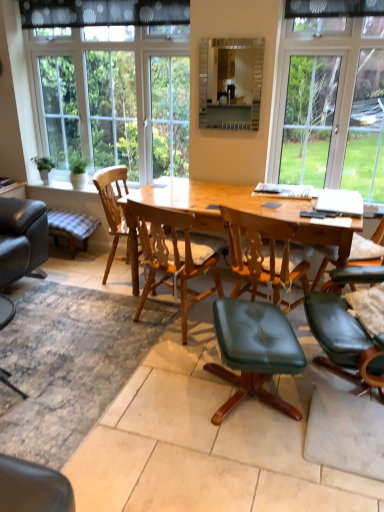
Where is `free spot to the right of green leather stool at center, which is counted as the third chair, starting from the back`? Image resolution: width=384 pixels, height=512 pixels. free spot to the right of green leather stool at center, which is counted as the third chair, starting from the back is located at coordinates (331, 412).